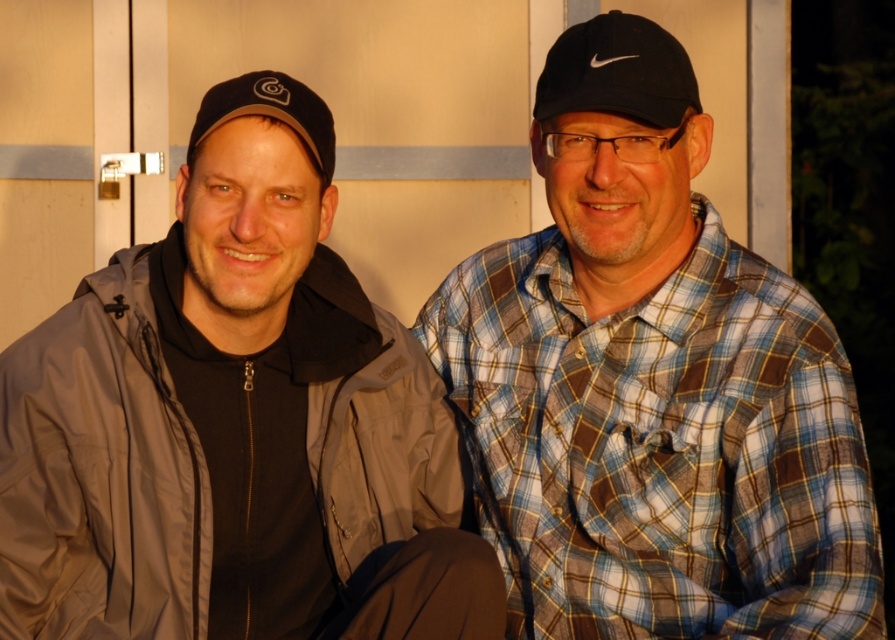
You are a photographer setting up for a portrait session. You need to ensure that the blue plaid shirt at center and the black matte baseball cap at left are both clearly visible in the frame. Based on their sizes, which object should you focus on first to ensure proper exposure?

The blue plaid shirt at center has a larger size compared to the black matte baseball cap at left, so you should focus on the blue plaid shirt at center first to ensure proper exposure since it occupies more of the frame.

You are trying to decide which person to approach for a quick question. The matte black jacket at left and the blue plaid shirt at center are both visible. Based on their sizes, which one is closer to you?

The matte black jacket at left is smaller than the blue plaid shirt at center, so the blue plaid shirt at center is closer to you because closer objects appear larger.